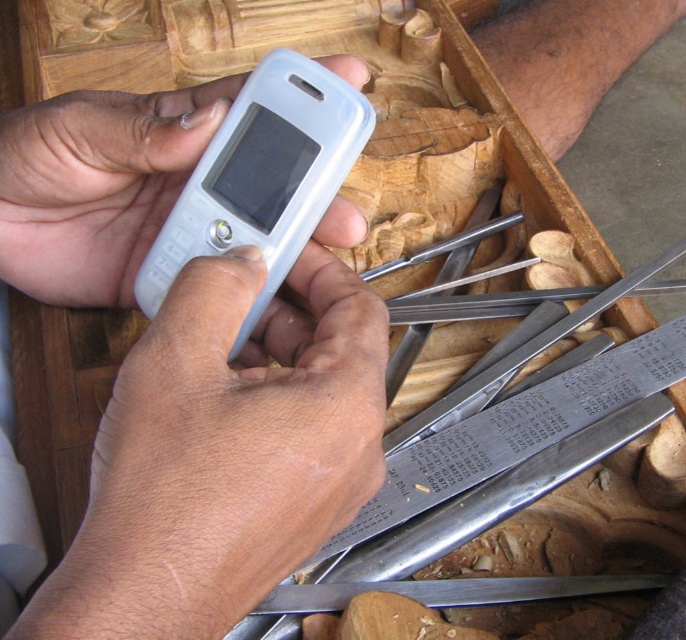
You are a photographer trying to capture a closeup of the tools in the wooden box. You notice two points marked in the scene. Which point is closer to your camera lens, point (370, 433) or point (224, 196)?

Point (370, 433) is closer to the viewer than point (224, 196), so the camera lens would capture it first.

Based on the scene description, what are the coordinates of the white plastic phone at center?

The white plastic phone at center is located at coordinates (224, 449).

You are a delivery person who needs to place both the white plastic phone at center and the white matte phone at center into a box that can only hold items within 2 inches apart. Can you fit both phones in the box?

The white plastic phone at center is 2.53 inches away from the white matte phone at center, which exceeds the 2 inches requirement. Therefore, you cannot fit both phones in the box.